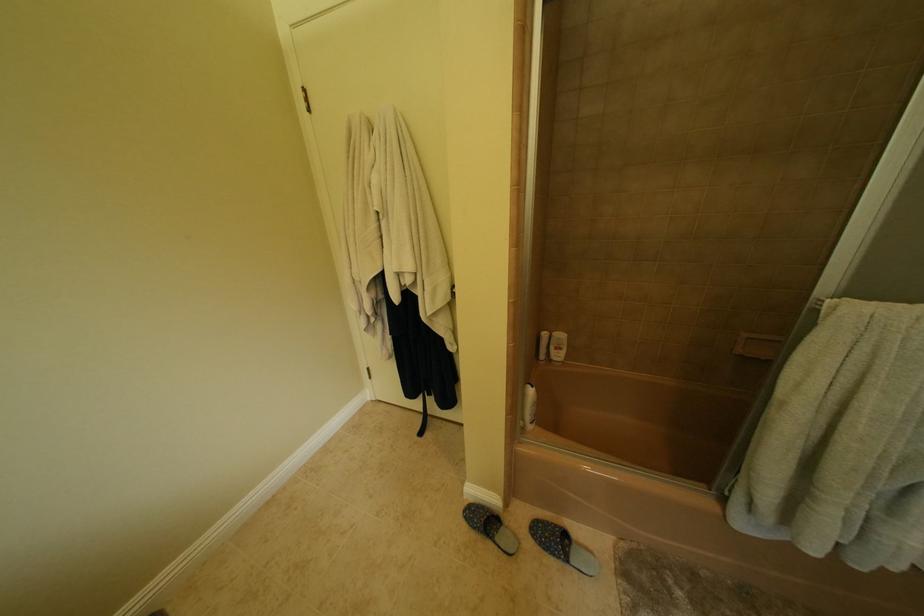
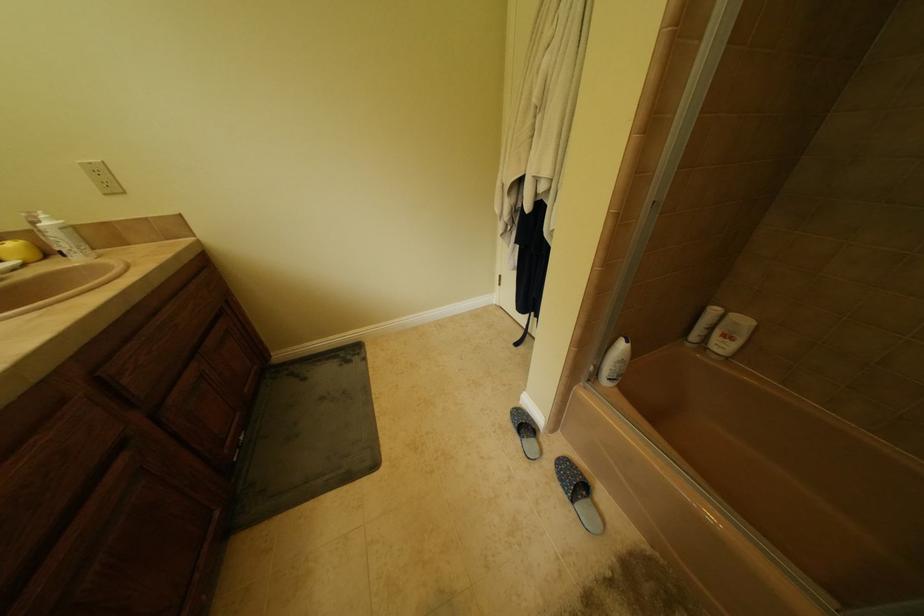
Based on the continuous images, in which direction is the camera rotating?

The camera rotated toward left-down.